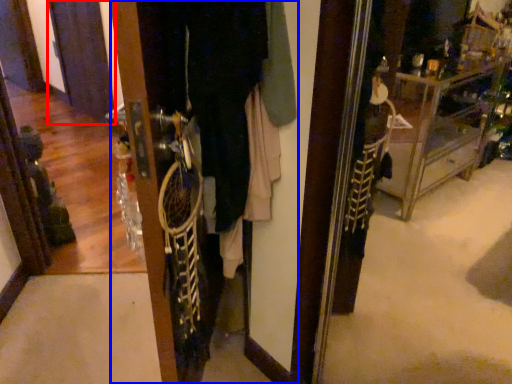
Question: Which point is further to the camera, screen door (highlighted by a red box) or closet (highlighted by a blue box)?

Choices:
 (A) screen door
 (B) closet

Answer: (A)